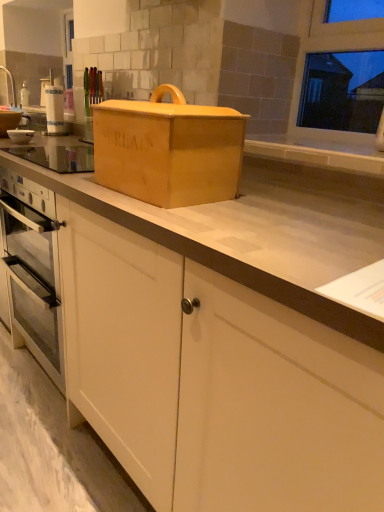
Question: Is point (13, 117) closer or farther from the camera than point (23, 142)?

Choices:
 (A) closer
 (B) farther

Answer: (B)

Question: Considering their positions, is white glossy sink at upper left located in front of or behind white glossy bowl at left?

Choices:
 (A) behind
 (B) front

Answer: (A)

Question: Which is nearer to the matte wooden bread box at center?

Choices:
 (A) white matte cabinet at lower center
 (B) white glossy sink at upper left
 (C) white glossy bowl at left

Answer: (A)

Question: Estimate the real-world distances between objects in this image. Which object is farther from the white matte cabinet at lower center?

Choices:
 (A) matte wooden bread box at center
 (B) white glossy sink at upper left
 (C) white glossy bowl at left

Answer: (B)